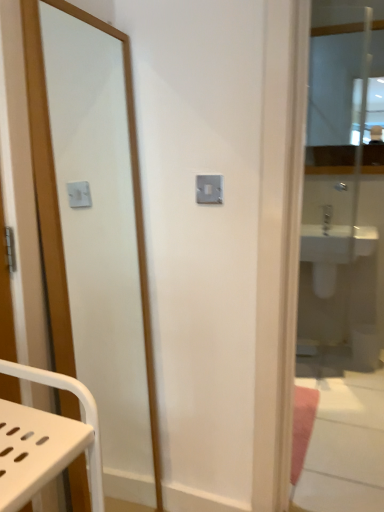
Question: Would you say white glossy sink at right is to the left or to the right of clear glass mirror at right, which ranks as the 2th mirror in front-to-back order, in the picture?

Choices:
 (A) left
 (B) right

Answer: (B)

Question: From the image's perspective, is white glossy sink at right located above or below clear glass mirror at right, which ranks as the 2th mirror in front-to-back order?

Choices:
 (A) above
 (B) below

Answer: (B)

Question: Based on their relative distances, which object is nearer to the white glossy sink at right?

Choices:
 (A) matte wooden mirror at left, which is the third mirror in back-to-front order
 (B) clear glass mirror at right, placed as the second mirror when sorted from right to left
 (C) clear glass mirror at upper right, which appears as the third mirror when viewed from the left

Answer: (B)

Question: Considering the real-world distances, which object is farthest from the clear glass mirror at right, the second mirror from the left?

Choices:
 (A) matte wooden mirror at left, the 1th mirror positioned from the front
 (B) clear glass mirror at upper right, which is the third mirror from front to back
 (C) white glossy sink at right

Answer: (B)